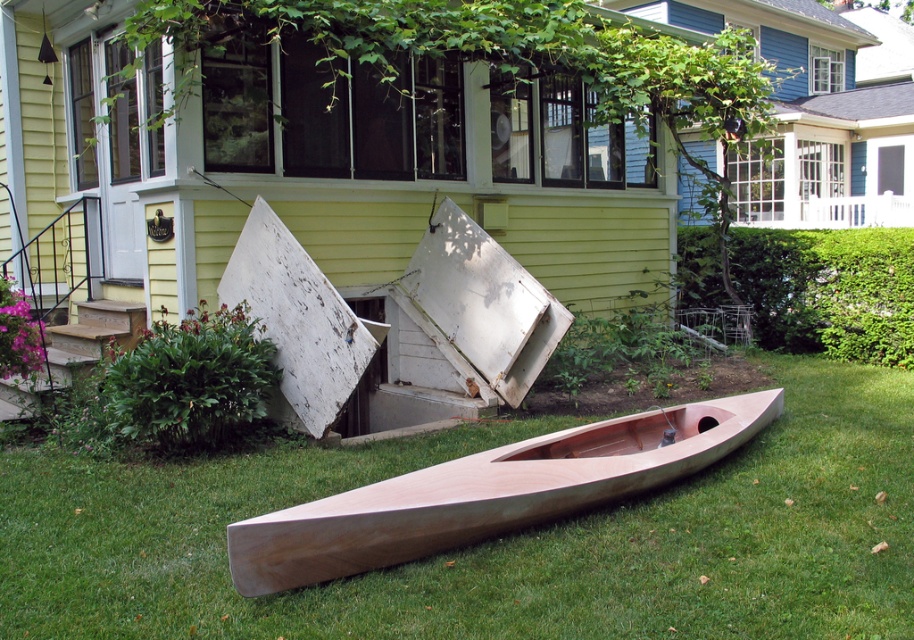
You are planning to place a large garden statue that is 3 meters tall in the backyard. Considering the green grass at lower center and the wooden canoe at center, which area would be more suitable for placing the statue without obstructing the view of the house?

The wooden canoe at center is larger than the green grass at lower center, so placing the statue on the green grass at lower center would be more suitable as it is smaller and less likely to block the view of the house.

You are standing in the backyard and want to walk from the wooden canoe at center to the green grass at lower center. Which direction should you move relative to the canoe?

You should move to the right side of the wooden canoe at center to reach the green grass at lower center since the green grass at lower center is positioned on the right side of the wooden canoe at center.